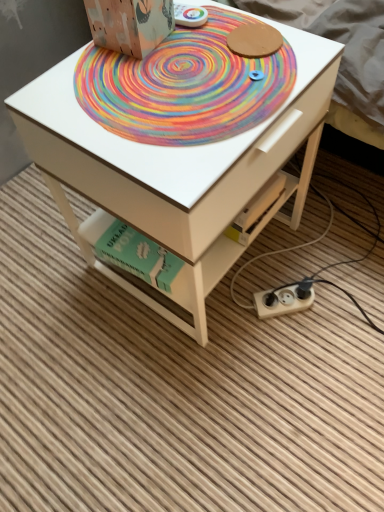
You are a GUI agent. You are given a task and a screenshot of the screen. Output one action in this format:
    pyautogui.click(x=<x>, y=<y>)
    Task: Click on the vacant space in between white matte table at center and white plastic plug at lower right
    
    Given the screenshot: What is the action you would take?
    pyautogui.click(x=277, y=287)